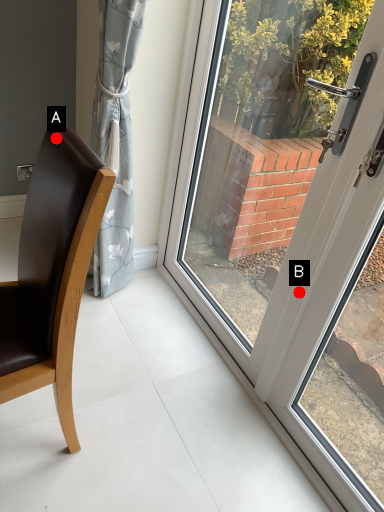
Question: Two points are circled on the image, labeled by A and B beside each circle. Which of the following is the farthest from the observer?

Choices:
 (A) A is further
 (B) B is further

Answer: (B)